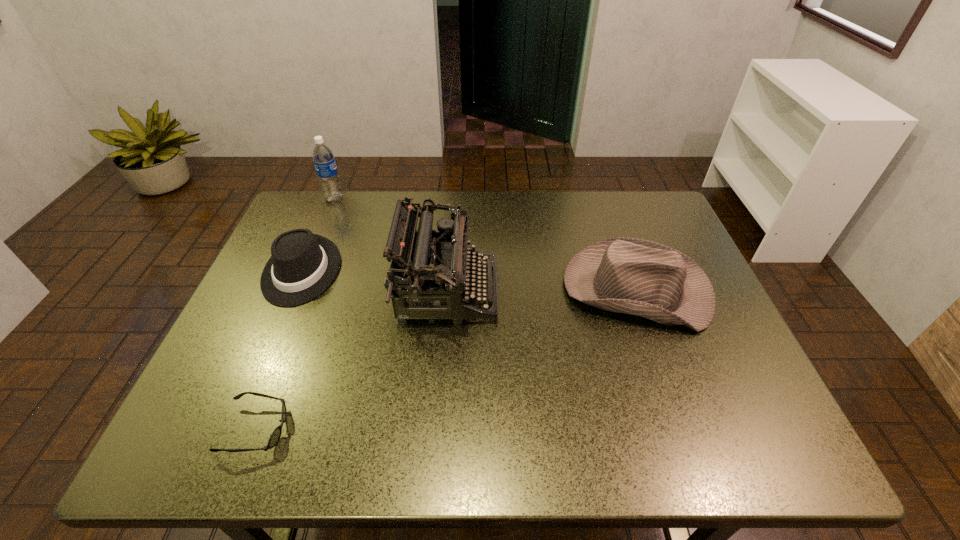
Identify the location of vacant area that lies between the right fedora and the fourth object from left to right. (541, 290).

Find the location of a particular element. vacant area between the second shortest object and the shortest object is located at coordinates (279, 350).

The width and height of the screenshot is (960, 540). In order to click on free space between the shortest object and the water bottle in this screenshot , I will do `click(296, 314)`.

The image size is (960, 540). What are the coordinates of `object that stands as the closest to the typewriter` in the screenshot? It's located at tap(302, 265).

Select which object appears as the fourth closest to the fourth object from left to right. Please provide its 2D coordinates. Your answer should be formatted as a tuple, i.e. [(x, y)], where the tuple contains the x and y coordinates of a point satisfying the conditions above.

[(323, 158)]

At what (x,y) coordinates should I click in order to perform the action: click on free space that satisfies the following two spatial constraints: 1. on the front side of the rightmost object; 2. on the lenses of the nearest object. Please return your answer as a coordinate pair (x, y). This screenshot has width=960, height=540. Looking at the image, I should click on (686, 429).

In order to click on vacant space that satisfies the following two spatial constraints: 1. on the front-facing side of the third shortest object; 2. on the right side of the second shortest object in this screenshot , I will do `click(294, 289)`.

Locate an element on the screen. Image resolution: width=960 pixels, height=540 pixels. free space that satisfies the following two spatial constraints: 1. on the front-facing side of the left fedora; 2. on the right side of the third shortest object is located at coordinates (294, 289).

Image resolution: width=960 pixels, height=540 pixels. Find the location of `free location that satisfies the following two spatial constraints: 1. on the front-facing side of the third shortest object; 2. on the left side of the fourth tallest object`. free location that satisfies the following two spatial constraints: 1. on the front-facing side of the third shortest object; 2. on the left side of the fourth tallest object is located at coordinates (294, 289).